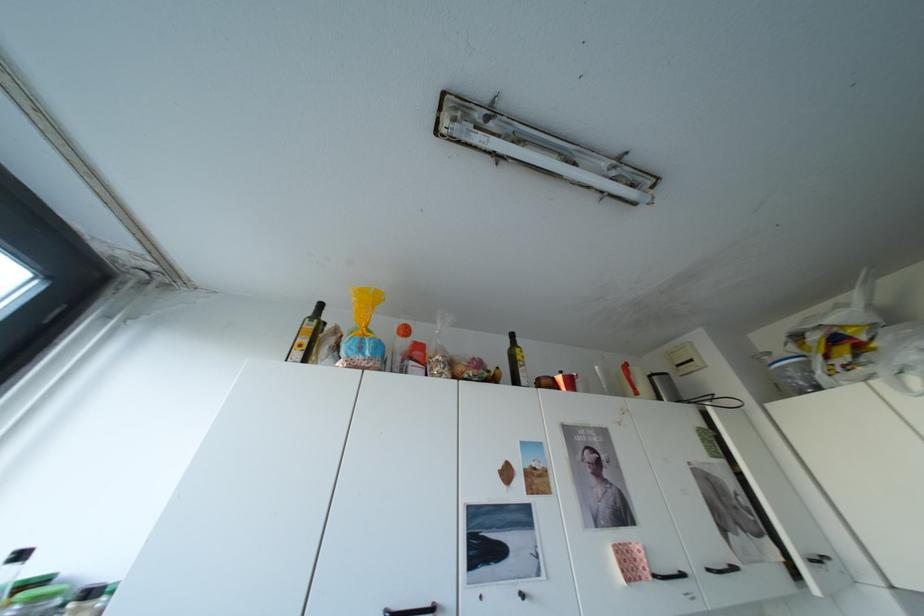
Find where to grasp the red utensil handle. Please return your answer as a coordinate pair (x, y).

(634, 382)